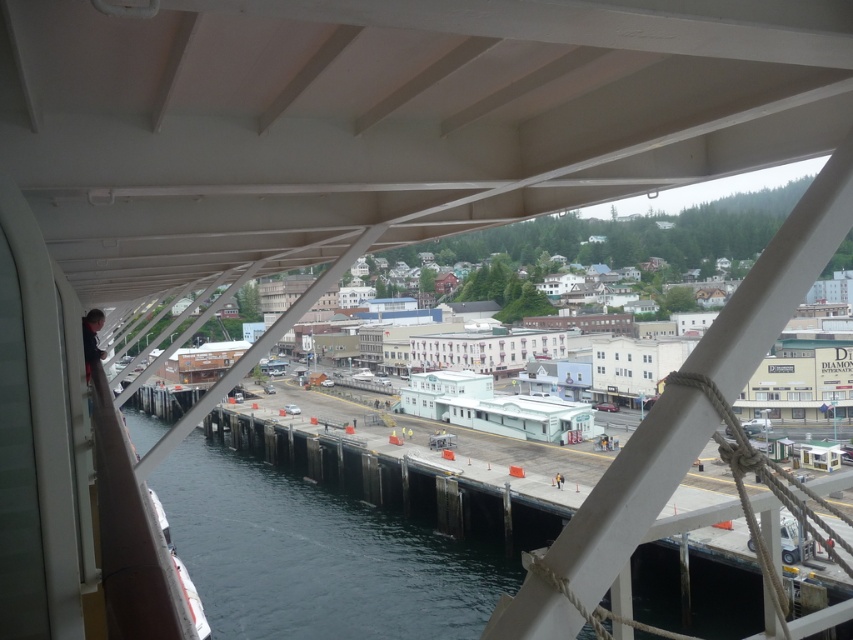
Is dark blue water at lower left closer to the viewer compared to white matte beam at upper right?

No, it is not.

Who is more forward, (x=397, y=509) or (x=714, y=417)?

Positioned in front is point (x=714, y=417).

Where is `dark blue water at lower left`? The width and height of the screenshot is (853, 640). dark blue water at lower left is located at coordinates (339, 540).